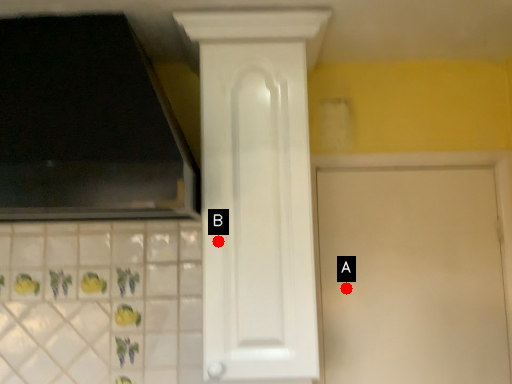
Question: Two points are circled on the image, labeled by A and B beside each circle. Which point is farther to the camera?

Choices:
 (A) A is further
 (B) B is further

Answer: (A)